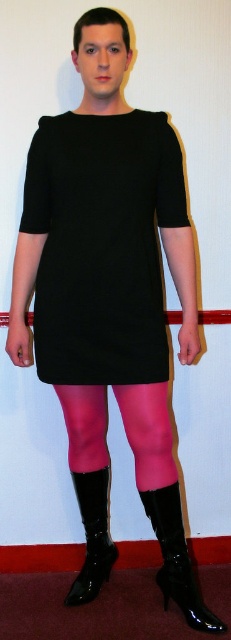
You are a fashion designer trying to create a new outfit based on the image. You need to know the relative sizes of the pink sheer tights at lower center and the black patent leather boot at lower center. Which one is bigger in size?

The pink sheer tights at lower center has a larger size compared to the black patent leather boot at lower center.

You are a tailor measuring the distance between two boots in the image. The glossy patent leather boot at lower center and the black patent leather boot at lower center are both on the floor. Can you fit a 10 inch ruler between them without bending it?

The distance between the glossy patent leather boot at lower center and the black patent leather boot at lower center is 10.52 inches, so yes, a 10 inch ruler can fit between them without bending since the space is slightly larger than the ruler.

You are trying to decide which pair of boots to wear with your outfit. You have two options in front of you on the floor. The glossy patent leather boot at lower center and the black patent leather boot at lower center. Which one is shorter in height?

The glossy patent leather boot at lower center is shorter than the black patent leather boot at lower center.